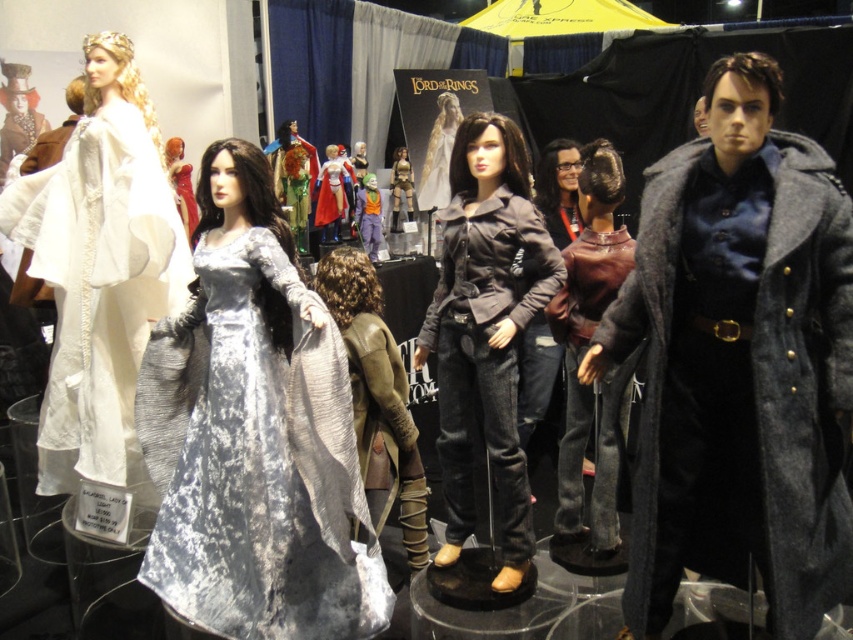
You are a guest at the exhibition and want to take a photo of both the silver velvet gown at center and the shiny red dress at center. Since you can only focus on one at a time, which one should you position your camera to capture first if you want to follow the natural left to right viewing order?

You should position your camera to capture the shiny red dress at center first because the silver velvet gown at center is to the right of it, following the natural left to right viewing order.

You are a photographer at the exhibition and want to capture a photo where both the burgundy leather jacket at center and the metallic gold armor at center are visible. However, you notice that one of them might be blocking the other due to their sizes. Based on their heights, which one is taller and might block the view of the other?

The burgundy leather jacket at center is taller than the metallic gold armor at center, so it might block the view of the metallic gold armor at center in the photo.

You are an artist trying to create a miniature version of the scene. You need to know which object at center is larger to scale them appropriately. Which one is bigger between the burgundy leather jacket at center and the metallic gold armor at center?

The burgundy leather jacket at center is bigger than the metallic gold armor at center, so you should scale the burgundy leather jacket at center larger than the metallic gold armor at center in your miniature version.